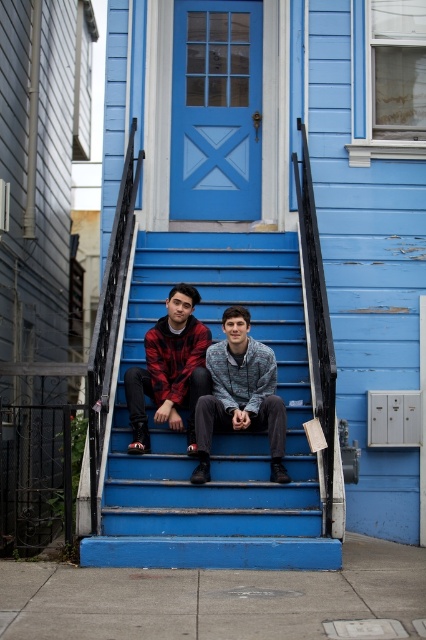
Question: Which point appears closest to the camera in this image?

Choices:
 (A) (146, 506)
 (B) (276, 458)
 (C) (198, 349)

Answer: (A)

Question: Which object is closer to the camera taking this photo?

Choices:
 (A) blue matte stairs at center
 (B) plaid fabric shirt at center
 (C) red plaid shirt at center

Answer: (B)

Question: Does blue matte stairs at center have a lesser width compared to red plaid shirt at center?

Choices:
 (A) yes
 (B) no

Answer: (B)

Question: Observing the image, what is the correct spatial positioning of blue matte stairs at center in reference to red plaid shirt at center?

Choices:
 (A) below
 (B) above

Answer: (B)

Question: Based on their relative distances, which object is nearer to the plaid fabric shirt at center?

Choices:
 (A) blue matte stairs at center
 (B) red plaid shirt at center

Answer: (B)

Question: Does plaid fabric shirt at center appear on the left side of red plaid shirt at center?

Choices:
 (A) yes
 (B) no

Answer: (B)